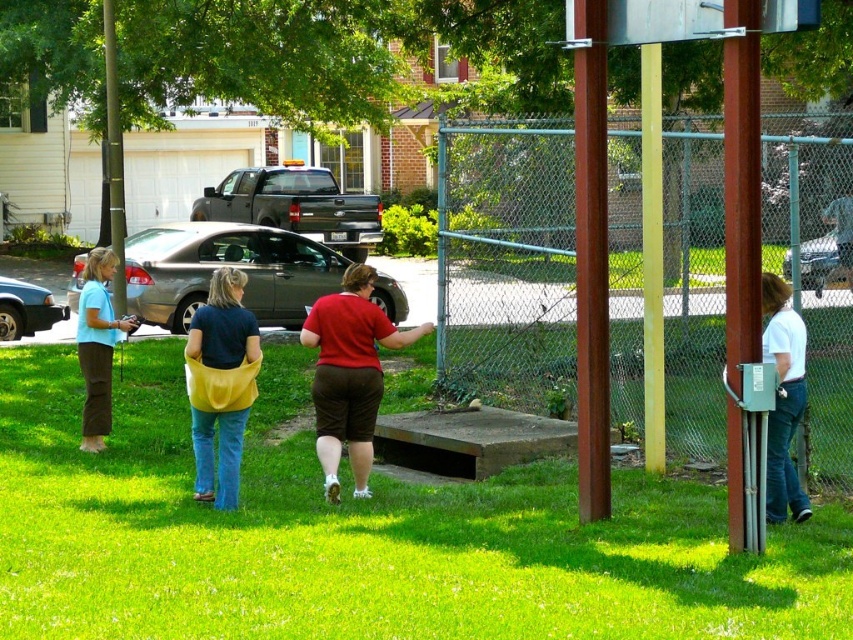
You are a photographer trying to capture both the metallic silver basketball hoop at right and the matte blue shirt at left in the same frame. Given their sizes, which object will appear bigger in your photo?

The metallic silver basketball hoop at right will appear bigger in the photo because it is larger in size than the matte blue shirt at left.

You are standing in the residential area and see the metallic silver basketball hoop at right and the matte blue shirt at left. Which object is positioned higher relative to the other?

The metallic silver basketball hoop at right is located above the matte blue shirt at left, so it is positioned higher.